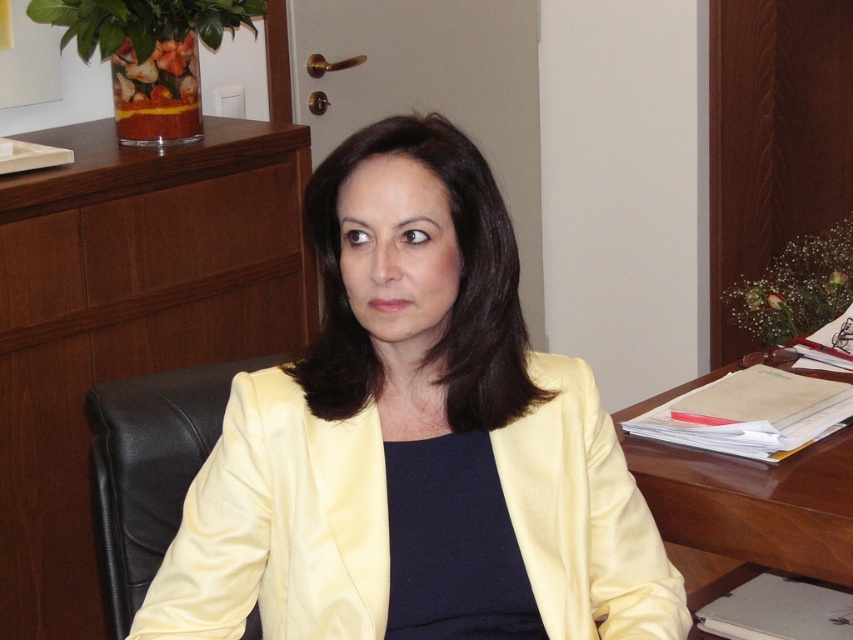
From the picture: Can you confirm if brown wood computer desk at upper center is positioned to the right of black leather chair at left?

No, brown wood computer desk at upper center is not to the right of black leather chair at left.

Find the location of a particular element. brown wood computer desk at upper center is located at coordinates (126, 317).

Based on the photo, does satin yellow jacket at center lie in front of brown wood computer desk at upper center?

Yes, satin yellow jacket at center is closer to the viewer.

Is satin yellow jacket at center further to camera compared to brown wood computer desk at upper center?

No, satin yellow jacket at center is closer to the viewer.

Between point (384, 509) and point (68, 224), which one is positioned behind?

Point (68, 224)

Image resolution: width=853 pixels, height=640 pixels. I want to click on satin yellow jacket at center, so click(415, 440).

Is brown wooden table at right to the left of black leather chair at left from the viewer's perspective?

In fact, brown wooden table at right is to the right of black leather chair at left.

Does brown wooden table at right have a greater width compared to black leather chair at left?

Correct, the width of brown wooden table at right exceeds that of black leather chair at left.

Who is more distant from viewer, (767,493) or (259,637)?

The point (259,637) is behind.

Image resolution: width=853 pixels, height=640 pixels. Find the location of `brown wooden table at right`. brown wooden table at right is located at coordinates (747, 500).